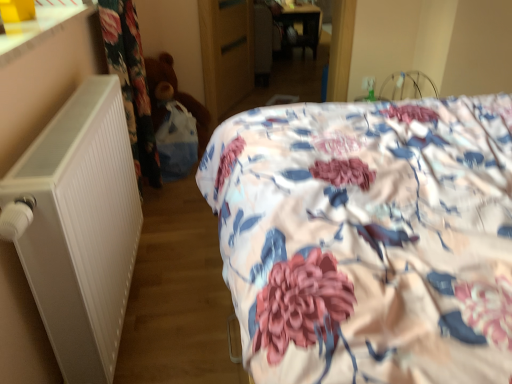
What do you see at coordinates (226, 52) in the screenshot? I see `wooden wardrobe at center` at bounding box center [226, 52].

Image resolution: width=512 pixels, height=384 pixels. What do you see at coordinates (80, 228) in the screenshot?
I see `white matte radiator at left` at bounding box center [80, 228].

Find the location of a particular element. The width and height of the screenshot is (512, 384). floral fabric bed at center is located at coordinates (368, 239).

How much distance is there between wooden wardrobe at center and brown plush teddy bear at left?

wooden wardrobe at center is 18.92 inches from brown plush teddy bear at left.

From the image's perspective, does wooden wardrobe at center appear higher than brown plush teddy bear at left?

Yes, from the image's perspective, wooden wardrobe at center is above brown plush teddy bear at left.

Considering the relative positions of wooden wardrobe at center and brown plush teddy bear at left in the image provided, is wooden wardrobe at center to the right of brown plush teddy bear at left from the viewer's perspective?

Yes.

Considering the points (218, 8) and (174, 74), which point is behind, point (218, 8) or point (174, 74)?

The point (218, 8) is more distant.

Can you tell me how much floral fabric bed at center and white matte radiator at left differ in facing direction?

The angle between the facing direction of floral fabric bed at center and the facing direction of white matte radiator at left is 90.2 degrees.

Do you think floral fabric bed at center is within white matte radiator at left, or outside of it?

floral fabric bed at center exists outside the volume of white matte radiator at left.

In the image, is floral fabric bed at center on the left side or the right side of white matte radiator at left?

Clearly, floral fabric bed at center is on the right of white matte radiator at left in the image.

Locate an element on the screen. This screenshot has height=384, width=512. radiator below the floral fabric bed at center (from a real-world perspective) is located at coordinates (80, 228).

Is brown plush teddy bear at left not inside wooden wardrobe at center?

Yes, brown plush teddy bear at left is outside of wooden wardrobe at center.

I want to click on armoire on the right of brown plush teddy bear at left, so click(x=226, y=52).

Which object is further away from the camera, brown plush teddy bear at left or wooden wardrobe at center?

wooden wardrobe at center is further away from the camera.

Is wooden wardrobe at center completely or partially inside white matte radiator at left?

That's incorrect, wooden wardrobe at center is not inside white matte radiator at left.

Is white matte radiator at left taller or shorter than wooden wardrobe at center?

In the image, white matte radiator at left appears to be shorter than wooden wardrobe at center.

How much distance is there between white matte radiator at left and wooden wardrobe at center?

They are 1.74 meters apart.

Can you confirm if white matte radiator at left is wider than wooden wardrobe at center?

Yes.

Looking at this image, considering the relative positions of white matte radiator at left and brown plush teddy bear at left in the image provided, is white matte radiator at left to the right of brown plush teddy bear at left from the viewer's perspective?

Yes, white matte radiator at left is to the right of brown plush teddy bear at left.

How many degrees apart are the facing directions of white matte radiator at left and brown plush teddy bear at left?

They differ by 2.57e-05 degrees in their facing directions.

Which of these two, white matte radiator at left or brown plush teddy bear at left, is bigger?

brown plush teddy bear at left is bigger.

Does white matte radiator at left turn towards brown plush teddy bear at left?

No.

Looking at this image, from the image's perspective, is brown plush teddy bear at left under white matte radiator at left?

No.

Is brown plush teddy bear at left touching white matte radiator at left?

brown plush teddy bear at left is not next to white matte radiator at left, and they're not touching.

From a real-world perspective, is brown plush teddy bear at left over white matte radiator at left?

No, from a real-world perspective, brown plush teddy bear at left is not on top of white matte radiator at left.

Is white matte radiator at left completely or partially inside brown plush teddy bear at left?

Definitely not — white matte radiator at left is not inside brown plush teddy bear at left.

Is the surface of floral fabric bed at center in direct contact with wooden wardrobe at center?

No, floral fabric bed at center is not beside wooden wardrobe at center.

Considering the positions of objects floral fabric bed at center and wooden wardrobe at center in the image provided, who is more to the left, floral fabric bed at center or wooden wardrobe at center?

wooden wardrobe at center is more to the left.

Considering the relative positions of floral fabric bed at center and wooden wardrobe at center in the image provided, is floral fabric bed at center behind wooden wardrobe at center?

No, floral fabric bed at center is closer to the viewer.

Identify the location of teddy below the wooden wardrobe at center (from the image's perspective). [173, 97].

The image size is (512, 384). Identify the location of radiator lying behind the floral fabric bed at center. (80, 228).

From the image, which object appears to be farther from floral fabric bed at center, wooden wardrobe at center or brown plush teddy bear at left?

wooden wardrobe at center.

Looking at the image, which one is located further to brown plush teddy bear at left, floral fabric bed at center or white matte radiator at left?

floral fabric bed at center.

Which object lies further to the anchor point brown plush teddy bear at left, floral fabric bed at center or wooden wardrobe at center?

floral fabric bed at center.

When comparing their distances from white matte radiator at left, does wooden wardrobe at center or floral fabric bed at center seem further?

Among the two, wooden wardrobe at center is located further to white matte radiator at left.

Based on their spatial positions, is wooden wardrobe at center or floral fabric bed at center further from brown plush teddy bear at left?

floral fabric bed at center.

Which object lies further to the anchor point wooden wardrobe at center, floral fabric bed at center or brown plush teddy bear at left?

The object further to wooden wardrobe at center is floral fabric bed at center.

Which object lies nearer to the anchor point floral fabric bed at center, wooden wardrobe at center or white matte radiator at left?

white matte radiator at left is closer to floral fabric bed at center.

Based on their spatial positions, is floral fabric bed at center or wooden wardrobe at center further from white matte radiator at left?

wooden wardrobe at center is positioned further to the anchor white matte radiator at left.

Locate an element on the screen. teddy between white matte radiator at left and wooden wardrobe at center from front to back is located at coordinates (173, 97).

The width and height of the screenshot is (512, 384). I want to click on radiator located between floral fabric bed at center and wooden wardrobe at center in the depth direction, so click(80, 228).

Where is `teddy between floral fabric bed at center and wooden wardrobe at center in the front-back direction`? This screenshot has height=384, width=512. teddy between floral fabric bed at center and wooden wardrobe at center in the front-back direction is located at coordinates (173, 97).

The height and width of the screenshot is (384, 512). Identify the location of radiator located between floral fabric bed at center and brown plush teddy bear at left in the depth direction. (80, 228).